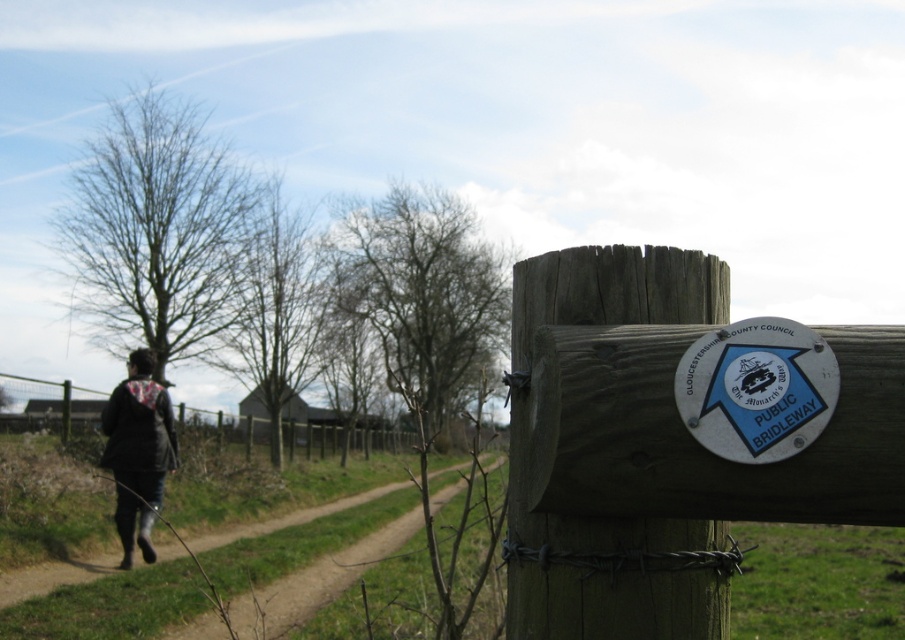
You are standing at the point marked by the coordinate (x=556, y=451), which is the green wood signpost at center. You want to walk towards the cluster of bare trees in the background. Which direction should you head?

The green wood signpost at center is located at point (x=556, y=451). The dirt path leading to the cluster of bare trees is in the background, so you should walk towards the background direction from the signpost to reach the trees.

You are a hiker carrying a 30 meter long rope. You want to tie the rope between the green wood signpost at center and the wooden fence at left. Will the rope be long enough to stretch between them without any slack?

The green wood signpost at center is 28.20 meters from the wooden fence at left. The rope is 30 meters long, which is longer than the distance between them, so the rope will be long enough to stretch between them with some slack remaining.